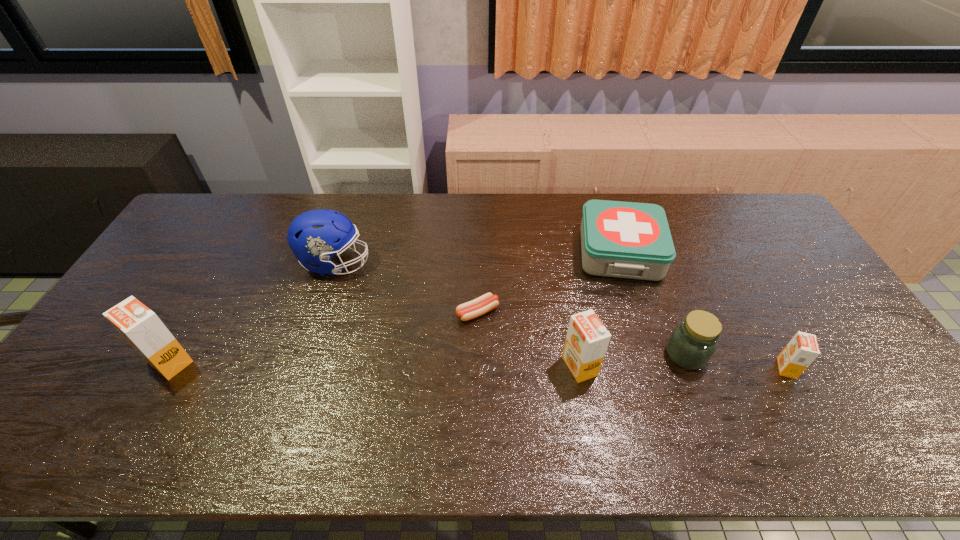
Identify the location of vacant point located between the leftmost orange juice and the sausage. (324, 337).

What are the coordinates of `free space between the first-aid kit and the jar` in the screenshot? It's located at (653, 304).

You are a GUI agent. You are given a task and a screenshot of the screen. Output one action in this format:
    pyautogui.click(x=<x>, y=<y>)
    Task: Click on the empty space that is in between the first-aid kit and the leftmost object
    
    Given the screenshot: What is the action you would take?
    pyautogui.click(x=396, y=307)

This screenshot has height=540, width=960. What are the coordinates of `free space between the rightmost orange juice and the sausage` in the screenshot? It's located at (632, 340).

Identify the location of object identified as the third closest to the sixth object from right to left. (587, 339).

Locate which object is the fourth closest to the fifth object from right to left. Please provide its 2D coordinates. Your answer should be formatted as a tuple, i.e. [(x, y)], where the tuple contains the x and y coordinates of a point satisfying the conditions above.

[(693, 342)]

Identify the location of orange juice that is the closest to the rightmost object. This screenshot has height=540, width=960. (587, 339).

In order to click on orange juice that stands as the third closest to the jar in this screenshot , I will do `click(141, 327)`.

Where is `free space that satisfies the following two spatial constraints: 1. on the back side of the leftmost orange juice; 2. on the left side of the jar`? The image size is (960, 540). free space that satisfies the following two spatial constraints: 1. on the back side of the leftmost orange juice; 2. on the left side of the jar is located at coordinates (175, 355).

Where is `vacant space that satisfies the following two spatial constraints: 1. on the front side of the shortest orange juice; 2. on the right side of the first-aid kit`? This screenshot has width=960, height=540. vacant space that satisfies the following two spatial constraints: 1. on the front side of the shortest orange juice; 2. on the right side of the first-aid kit is located at coordinates (657, 368).